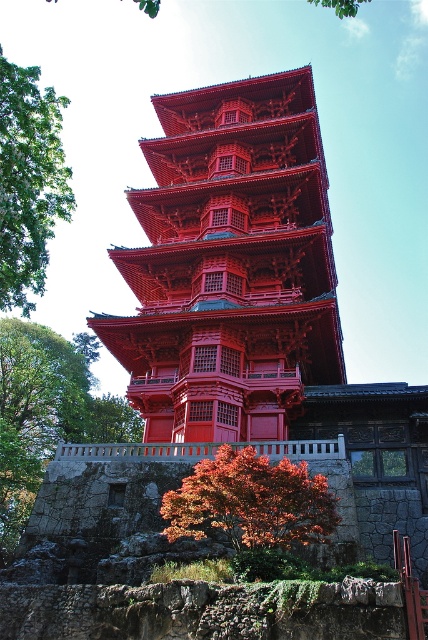
You are standing in front of a traditional East Asian garden and want to take a photo of the matte wood pagoda at center. If your camera can focus on objects up to 150 feet away, will it be able to capture the pagoda clearly?

The matte wood pagoda at center is 149.18 feet away from camera, so yes, the camera can focus on it clearly since the distance is within its 150 feet range.

You are planning to install a new pathway between the green leafy tree at upper left and the shiny red maple tree at lower center. The pathway requires a minimum of 100 feet of space. Based on the scene, will there be enough space for the pathway?

The distance between the green leafy tree at upper left and the shiny red maple tree at lower center is 103.02 feet, which exceeds the required 100 feet. Therefore, there is sufficient space to install the pathway.

You are standing in front of the red pagoda and notice a specific point in the image. Based on the coordinates given, which object is located at point (29, 180)?

The point (29, 180) corresponds to the green leafy tree at upper left.